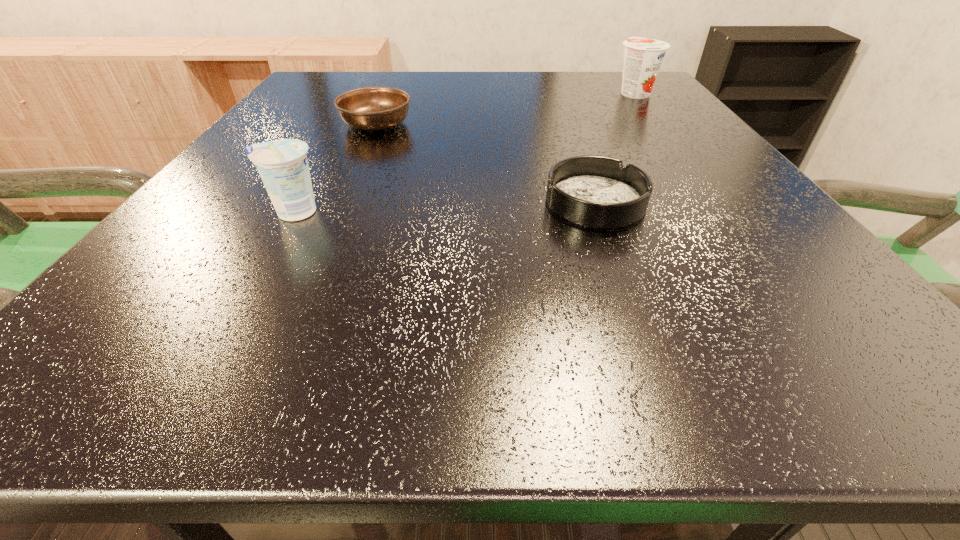
You are a GUI agent. You are given a task and a screenshot of the screen. Output one action in this format:
    pyautogui.click(x=<x>, y=<y>)
    Task: Click on the unoccupied position between the farthest object and the left yogurt
    This screenshot has width=960, height=540.
    Given the screenshot: What is the action you would take?
    pyautogui.click(x=464, y=152)

At what (x,y) coordinates should I click in order to perform the action: click on vacant area that lies between the soup bowl and the right yogurt. Please return your answer as a coordinate pair (x, y). Looking at the image, I should click on (505, 108).

Identify which object is the closest to the nearer yogurt. Please provide its 2D coordinates. Your answer should be formatted as a tuple, i.e. [(x, y)], where the tuple contains the x and y coordinates of a point satisfying the conditions above.

[(372, 108)]

Locate an element on the screen. This screenshot has height=540, width=960. the third closest object to the right yogurt is located at coordinates (282, 164).